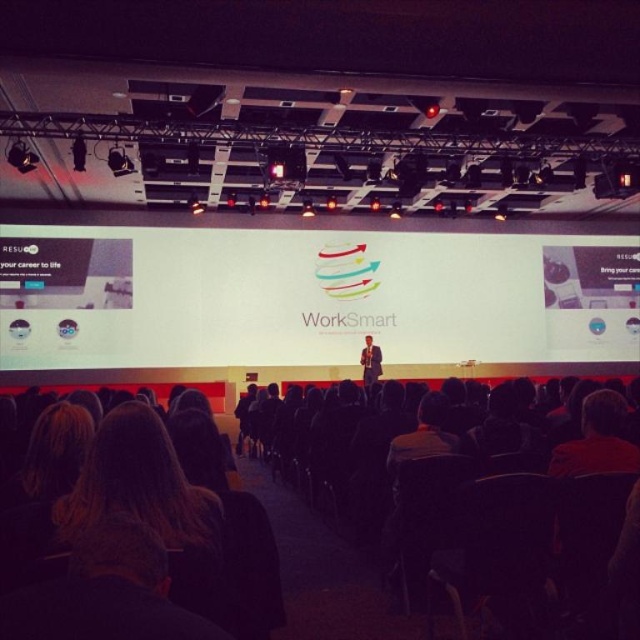
You are an event planner standing at the back of the room. You need to adjust the distance between the white matte projection screen at center and the dark suit at center to ensure proper visibility. Currently, they are 3.47 meters apart. What is the minimum distance you should maintain between them to ensure the presenter can comfortably view the screen without straining?

The minimum distance should be at least 3.47 meters, as that is the current distance between the white matte projection screen at center and the dark suit at center, ensuring the presenter can comfortably view the screen without straining.

Looking at this image, you are an event planner who needs to ensure that the dark suit at center is visible to the audience. Given that the white matte projection screen at center is much taller than it, what adjustment could you make to improve visibility?

Since the white matte projection screen at center is much taller than the dark suit at center, lowering the screen or raising the speaker wearing the dark suit at center would help ensure the audience can see the speaker clearly.